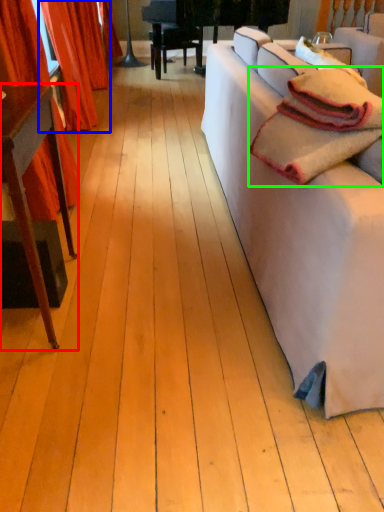
Question: Considering the real-world distances, which object is closest to table (highlighted by a red box)? curtain (highlighted by a blue box) or blanket (highlighted by a green box).

Choices:
 (A) curtain
 (B) blanket

Answer: (B)